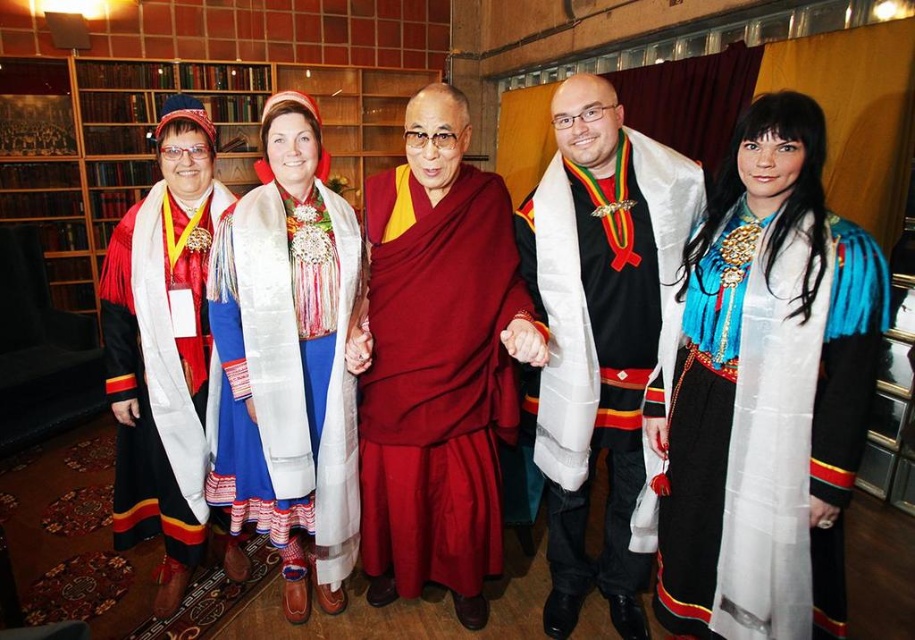
Question: Which of the following is the closest to the observer?

Choices:
 (A) (185, 244)
 (B) (761, 216)
 (C) (254, 385)
 (D) (596, 268)

Answer: (B)

Question: Which object is the farthest from the maroon silk robe at center?

Choices:
 (A) matte black robe at left
 (B) silky white scarf at center
 (C) black velvet robe at center

Answer: (A)

Question: Can you confirm if black velvet robe at center is positioned to the right of silky white scarf at center?

Choices:
 (A) yes
 (B) no

Answer: (A)

Question: Which object is positioned farthest from the black velvet robe at center?

Choices:
 (A) blue silk dress at center
 (B) maroon silk robe at center
 (C) silky white scarf at center

Answer: (C)

Question: Is black velvet robe at center to the left of matte black robe at left from the viewer's perspective?

Choices:
 (A) no
 (B) yes

Answer: (A)

Question: Can you confirm if blue silk dress at center is positioned to the right of black velvet robe at center?

Choices:
 (A) no
 (B) yes

Answer: (B)